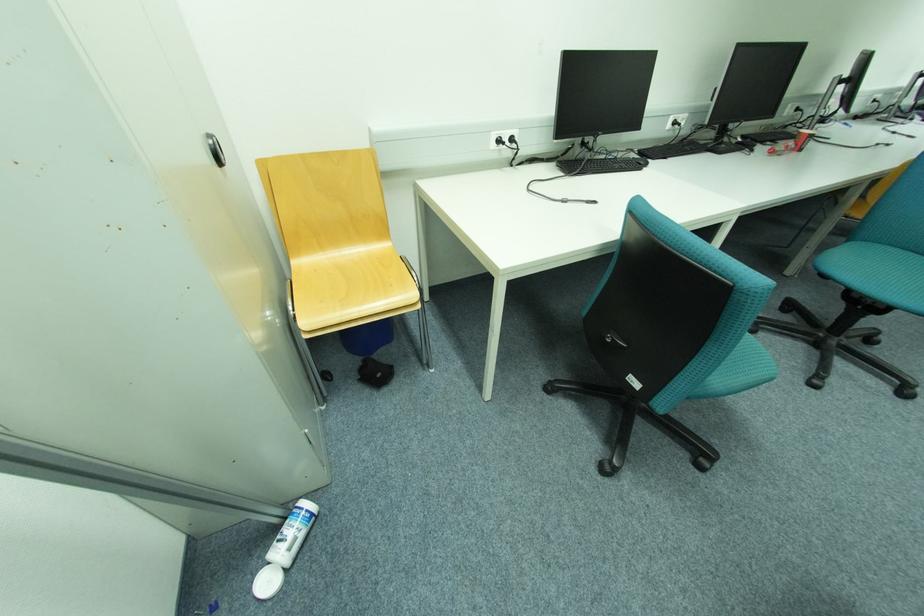
Where would you pull the chair adjustment lever? Please return your answer as a coordinate pair (x, y).

(614, 339)